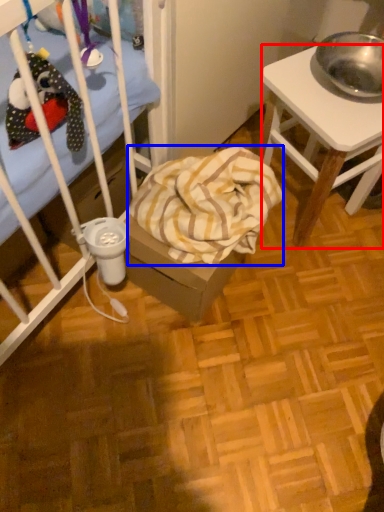
Question: Among these objects, which one is nearest to the camera, desk (highlighted by a red box) or blanket (highlighted by a blue box)?

Choices:
 (A) desk
 (B) blanket

Answer: (A)